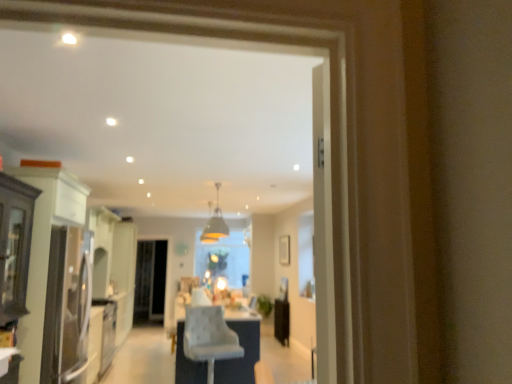
Question: Could you tell me if light gray fabric chair at center is turned towards matte white cabinet at left?

Choices:
 (A) no
 (B) yes

Answer: (A)

Question: Is light gray fabric chair at center positioned before matte white cabinet at left?

Choices:
 (A) yes
 (B) no

Answer: (B)

Question: Is light gray fabric chair at center to the left of matte white cabinet at left from the viewer's perspective?

Choices:
 (A) yes
 (B) no

Answer: (B)

Question: Would you say matte white cabinet at left is part of light gray fabric chair at center's contents?

Choices:
 (A) yes
 (B) no

Answer: (B)

Question: Can you confirm if light gray fabric chair at center is smaller than matte white cabinet at left?

Choices:
 (A) yes
 (B) no

Answer: (A)

Question: Is matte gold pendant light at center situated inside matte white cabinet at left or outside?

Choices:
 (A) inside
 (B) outside

Answer: (B)

Question: In terms of height, does matte gold pendant light at center look taller or shorter compared to matte white cabinet at left?

Choices:
 (A) short
 (B) tall

Answer: (A)

Question: From the image's perspective, is matte gold pendant light at center positioned above or below matte white cabinet at left?

Choices:
 (A) above
 (B) below

Answer: (A)

Question: Based on their sizes in the image, would you say matte gold pendant light at center is bigger or smaller than matte white cabinet at left?

Choices:
 (A) big
 (B) small

Answer: (B)

Question: From the image's perspective, is light gray fabric chair at center located above or below clear glass screen door at center?

Choices:
 (A) below
 (B) above

Answer: (B)

Question: Is light gray fabric chair at center spatially inside clear glass screen door at center, or outside of it?

Choices:
 (A) inside
 (B) outside

Answer: (B)

Question: Based on their sizes in the image, would you say light gray fabric chair at center is bigger or smaller than clear glass screen door at center?

Choices:
 (A) small
 (B) big

Answer: (A)

Question: Considering their positions, is light gray fabric chair at center located in front of or behind clear glass screen door at center?

Choices:
 (A) front
 (B) behind

Answer: (A)

Question: Considering the positions of clear glass screen door at center and matte gold pendant light at center in the image, is clear glass screen door at center wider or thinner than matte gold pendant light at center?

Choices:
 (A) thin
 (B) wide

Answer: (A)

Question: From a real-world perspective, is clear glass screen door at center positioned above or below matte gold pendant light at center?

Choices:
 (A) below
 (B) above

Answer: (A)